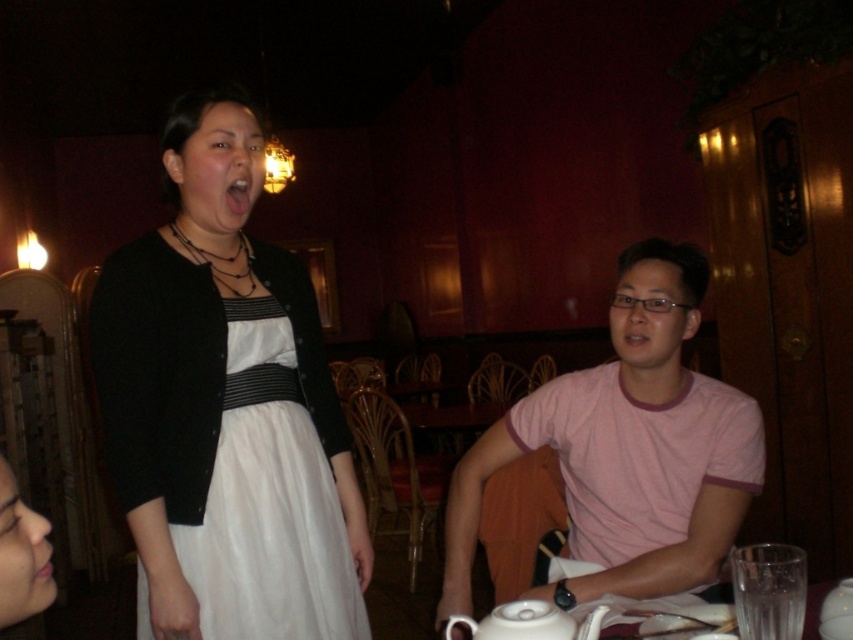
Based on the coordinates provided, which object is located at point (225, 410) in the image?

The point (225, 410) corresponds to the white matte dress at center.

Based on the scene description, which object is bigger between the pink glossy lips at center and the pink matte flesh at lower left?

The pink glossy lips at center is larger in size than the pink matte flesh at lower left.